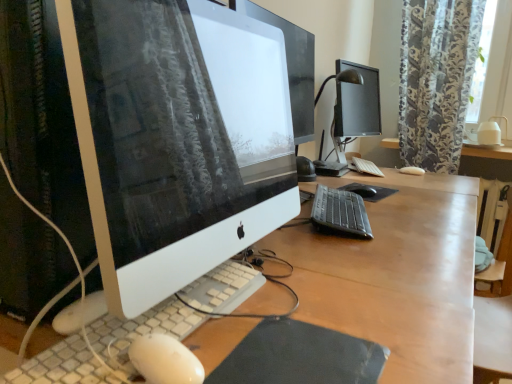
This screenshot has width=512, height=384. I want to click on empty space that is ontop of black matte mousepad at lower center, positioned as the second mousepad in right-to-left order (from a real-world perspective), so click(296, 349).